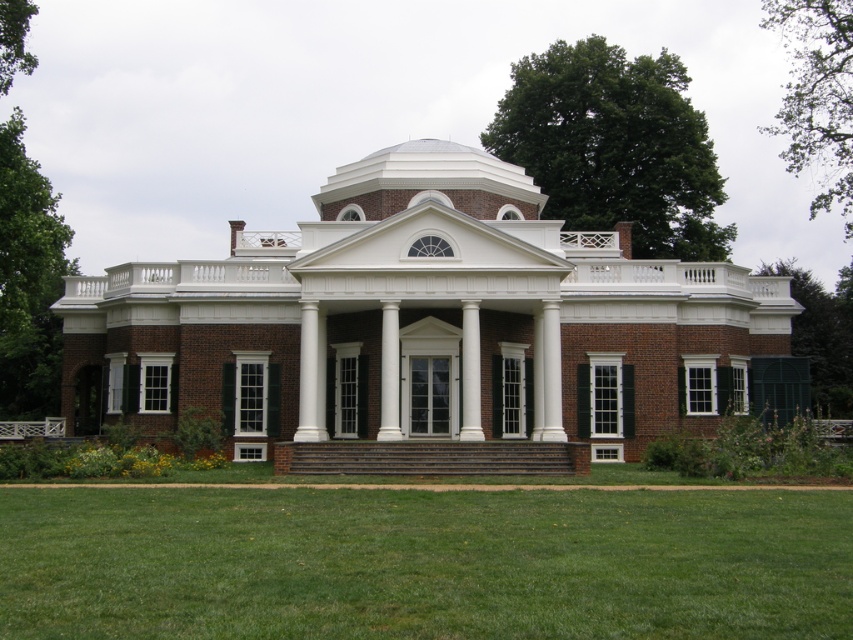
Is point (669, 426) farther from camera compared to point (44, 529)?

Yes, point (669, 426) is farther from viewer.

Does brick mansion at center have a larger size compared to green grass at lower center?

Yes, brick mansion at center is bigger than green grass at lower center.

Where is `brick mansion at center`? The image size is (853, 640). brick mansion at center is located at coordinates coord(428,323).

Locate an element on the screen. Image resolution: width=853 pixels, height=640 pixels. brick mansion at center is located at coordinates (428, 323).

Measure the distance between green grass at lower center and brown wooden stairs at center.

The distance of green grass at lower center from brown wooden stairs at center is 17.30 meters.

Does green grass at lower center have a larger size compared to brown wooden stairs at center?

Correct, green grass at lower center is larger in size than brown wooden stairs at center.

What do you see at coordinates (422, 563) in the screenshot?
I see `green grass at lower center` at bounding box center [422, 563].

Image resolution: width=853 pixels, height=640 pixels. What are the coordinates of `green grass at lower center` in the screenshot? It's located at (422, 563).

Does brick mansion at center come behind brown wooden stairs at center?

Yes, brick mansion at center is further from the viewer.

Identify the location of brick mansion at center. Image resolution: width=853 pixels, height=640 pixels. (428, 323).